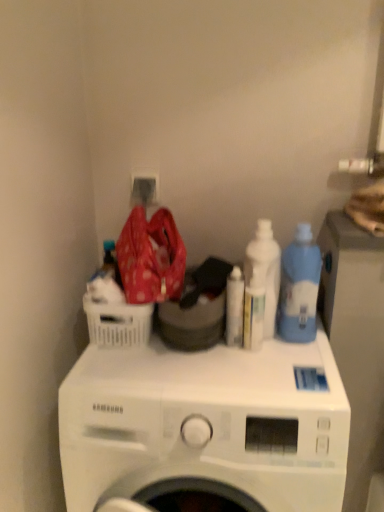
You are a GUI agent. You are given a task and a screenshot of the screen. Output one action in this format:
    pyautogui.click(x=<x>, y=<y>)
    Task: Click on the vacant space that is to the left of white glossy bottle at center, the 1th cleaning product when ordered from left to right
    Image resolution: width=384 pixels, height=512 pixels.
    Given the screenshot: What is the action you would take?
    pyautogui.click(x=150, y=362)